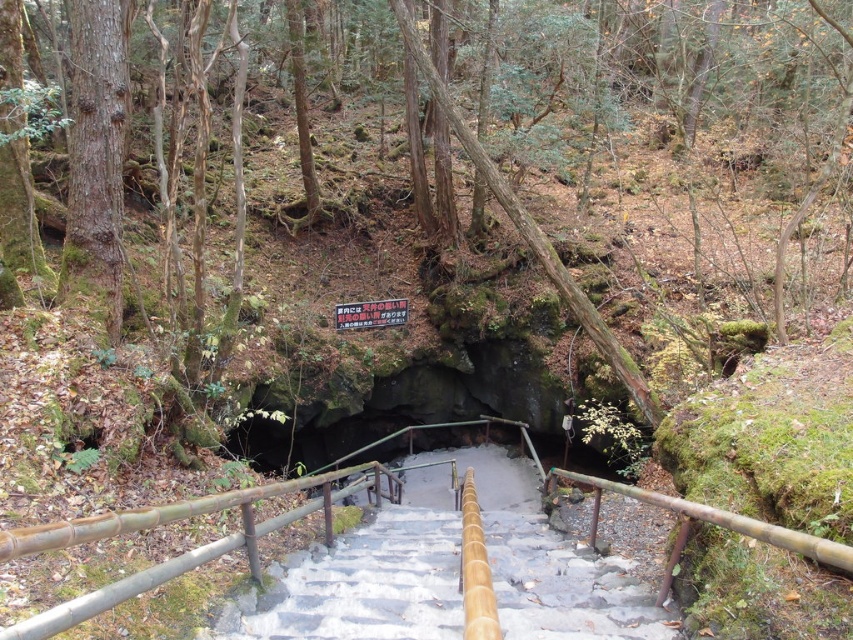
Between bamboo/rustic wood railing at center and black plastic sign at center, which one appears on the right side from the viewer's perspective?

From the viewer's perspective, bamboo/rustic wood railing at center appears more on the right side.

Does bamboo/rustic wood railing at center have a greater width compared to black plastic sign at center?

In fact, bamboo/rustic wood railing at center might be narrower than black plastic sign at center.

Locate an element on the screen. The height and width of the screenshot is (640, 853). bamboo/rustic wood railing at center is located at coordinates (186, 552).

I want to click on bamboo/rustic wood railing at center, so click(186, 552).

The width and height of the screenshot is (853, 640). What do you see at coordinates (387, 332) in the screenshot? I see `green mossy rock at center` at bounding box center [387, 332].

Does point (267, 192) lie behind point (401, 320)?

Yes, point (267, 192) is farther from viewer.

What are the coordinates of `green mossy rock at center` in the screenshot? It's located at (387, 332).

Can you confirm if green mossy rock at center is taller than bamboo/rustic wood railing at center?

Indeed, green mossy rock at center has a greater height compared to bamboo/rustic wood railing at center.

Can you confirm if green mossy rock at center is thinner than bamboo/rustic wood railing at center?

No.

Image resolution: width=853 pixels, height=640 pixels. Identify the location of green mossy rock at center. (387, 332).

This screenshot has width=853, height=640. I want to click on green mossy rock at center, so click(x=387, y=332).